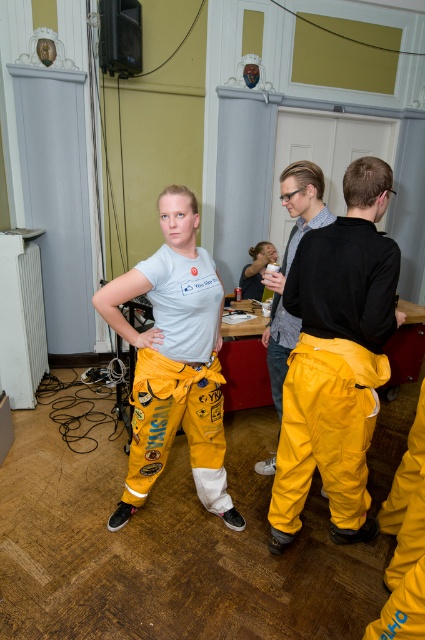
Can you confirm if yellow fabric pants at center is taller than yellow waterproof pants at center?

Indeed, yellow fabric pants at center has a greater height compared to yellow waterproof pants at center.

Is yellow fabric pants at center to the left of yellow waterproof pants at center from the viewer's perspective?

Indeed, yellow fabric pants at center is positioned on the left side of yellow waterproof pants at center.

Locate an element on the screen. The width and height of the screenshot is (425, 640). yellow fabric pants at center is located at coordinates (175, 360).

Identify the location of yellow rubber pants at center. (337, 358).

Can you confirm if yellow rubber pants at center is wider than yellow waterproof pants at center?

Yes.

I want to click on yellow rubber pants at center, so click(337, 358).

Can you confirm if yellow fabric pants at center is shorter than matte black shirt at center?

In fact, yellow fabric pants at center may be taller than matte black shirt at center.

In the scene shown: Which of these two, yellow fabric pants at center or matte black shirt at center, stands taller?

With more height is yellow fabric pants at center.

Between point (215, 352) and point (238, 284), which one is positioned in front?

Point (215, 352) is in front.

Locate an element on the screen. This screenshot has height=640, width=425. yellow fabric pants at center is located at coordinates (175, 360).